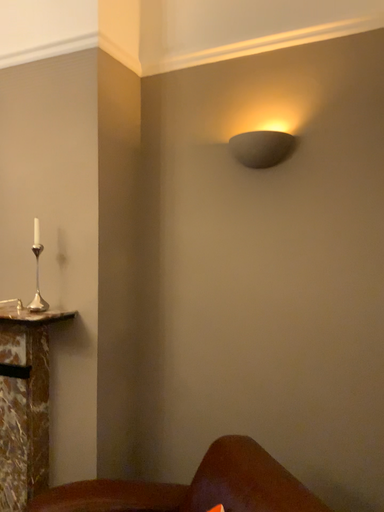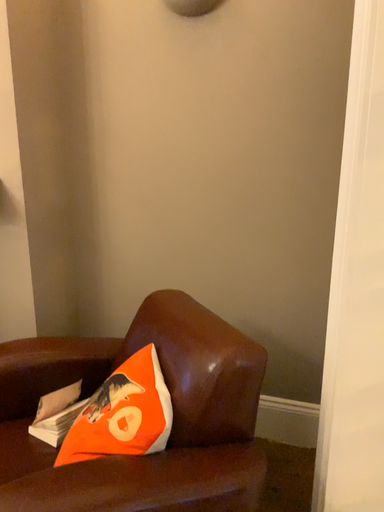
Question: Which way did the camera rotate in the video?

Choices:
 (A) rotated left
 (B) rotated right

Answer: (B)